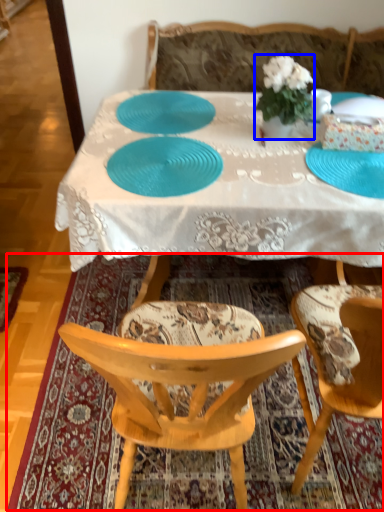
Question: Among these objects, which one is nearest to the camera, mat (highlighted by a red box) or houseplant (highlighted by a blue box)?

Choices:
 (A) mat
 (B) houseplant

Answer: (A)